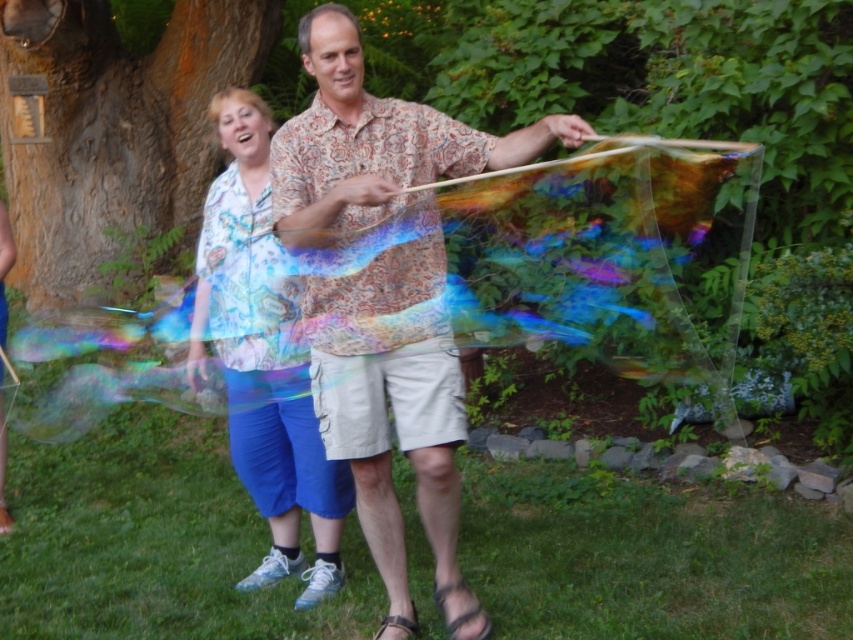
Question: Is patterned fabric shirt at center closer to the viewer compared to matte floral blouse at center?

Choices:
 (A) yes
 (B) no

Answer: (A)

Question: Which point is closer to the camera?

Choices:
 (A) (460, 172)
 (B) (300, 465)

Answer: (A)

Question: Is patterned fabric shirt at center to the left of matte floral blouse at center from the viewer's perspective?

Choices:
 (A) yes
 (B) no

Answer: (B)

Question: Among these objects, which one is nearest to the camera?

Choices:
 (A) matte floral blouse at center
 (B) patterned fabric shirt at center

Answer: (B)

Question: Which object is closer to the camera taking this photo?

Choices:
 (A) patterned fabric shirt at center
 (B) matte floral blouse at center

Answer: (A)

Question: Can you confirm if patterned fabric shirt at center is thinner than matte floral blouse at center?

Choices:
 (A) no
 (B) yes

Answer: (A)